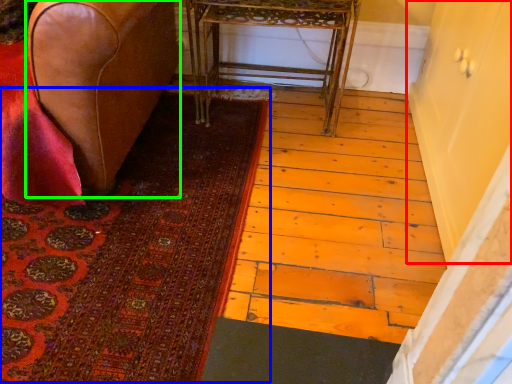
Question: Which is farther away from screen door (highlighted by a red box)? mat (highlighted by a blue box) or furniture (highlighted by a green box)?

Choices:
 (A) mat
 (B) furniture

Answer: (B)